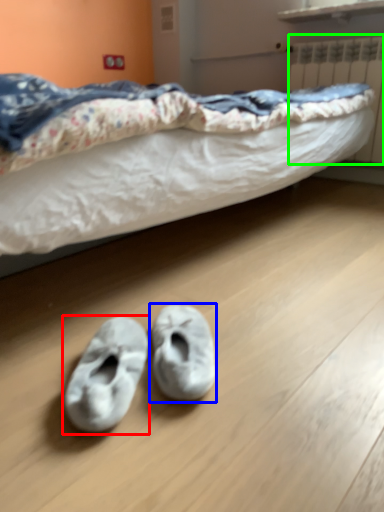
Question: Which is farther away from footwear (highlighted by a red box)? footwear (highlighted by a blue box) or radiator (highlighted by a green box)?

Choices:
 (A) footwear
 (B) radiator

Answer: (B)